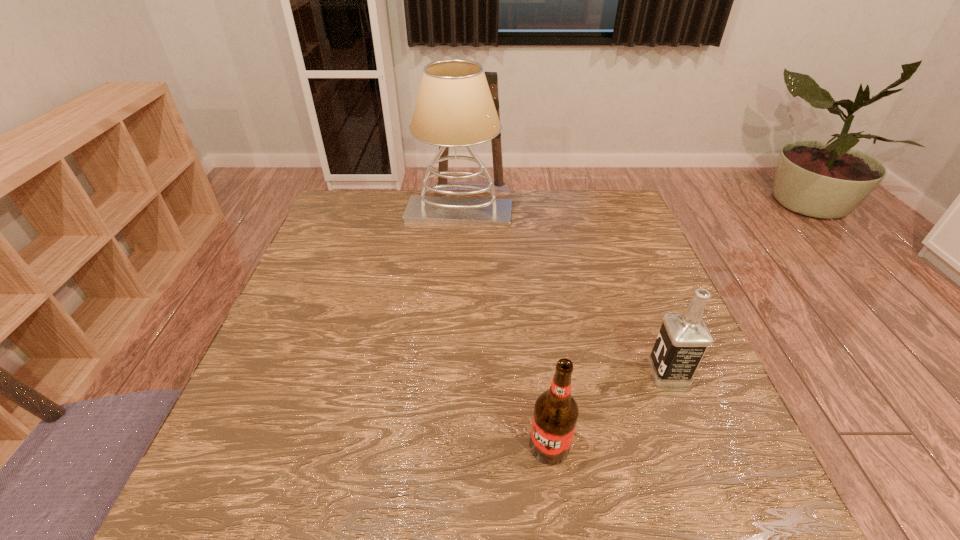
The image size is (960, 540). Find the location of `object situated at the far edge`. object situated at the far edge is located at coordinates (454, 108).

At what (x,y) coordinates should I click in order to perform the action: click on object positioned at the near edge. Please return your answer as a coordinate pair (x, y). Looking at the image, I should click on (556, 412).

The width and height of the screenshot is (960, 540). In order to click on object at the right edge in this screenshot , I will do `click(683, 339)`.

In the image, there is a desktop. At what (x,y) coordinates should I click in order to perform the action: click on vacant space at the far edge. Please return your answer as a coordinate pair (x, y). This screenshot has height=540, width=960. Looking at the image, I should click on (547, 221).

Image resolution: width=960 pixels, height=540 pixels. In the image, there is a desktop. Identify the location of vacant space at the near edge. coord(671,516).

You are a GUI agent. You are given a task and a screenshot of the screen. Output one action in this format:
    pyautogui.click(x=<x>, y=<y>)
    Task: Click on the free region at the left edge
    This screenshot has width=960, height=540.
    Given the screenshot: What is the action you would take?
    pyautogui.click(x=313, y=399)

You are a GUI agent. You are given a task and a screenshot of the screen. Output one action in this format:
    pyautogui.click(x=<x>, y=<y>)
    Task: Click on the vacant space at the right edge of the desktop
    
    Given the screenshot: What is the action you would take?
    pyautogui.click(x=599, y=267)

I want to click on free region at the far right corner, so click(626, 229).

The width and height of the screenshot is (960, 540). What are the coordinates of `free spot between the farthest object and the second farthest object` in the screenshot? It's located at (564, 293).

Locate an element on the screen. vacant area that lies between the second nearest object and the root beer is located at coordinates (609, 409).